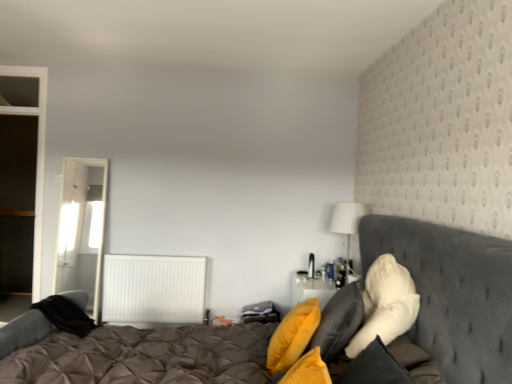
Measure the distance between white textured radiator at center and camera.

The depth of white textured radiator at center is 3.87 meters.

You are a GUI agent. You are given a task and a screenshot of the screen. Output one action in this format:
    pyautogui.click(x=<x>, y=<y>)
    Task: Click on the white textured radiator at center
    
    Given the screenshot: What is the action you would take?
    pyautogui.click(x=153, y=289)

What is the approximate width of tufted fabric bed at center?

tufted fabric bed at center is 7.62 feet wide.

This screenshot has height=384, width=512. I want to click on yellow fabric pillow at center, acting as the first pillow starting from the left, so click(293, 335).

Identify the location of white textured radiator at center. The height and width of the screenshot is (384, 512). (153, 289).

From a real-world perspective, is white textured radiator at center under tufted fabric bed at center?

Yes, from a real-world perspective, white textured radiator at center is under tufted fabric bed at center.

Is white textured radiator at center to the right of tufted fabric bed at center from the viewer's perspective?

A: Incorrect, white textured radiator at center is not on the right side of tufted fabric bed at center.

Can you tell me how much white textured radiator at center and white sheer curtain at left differ in facing direction?

The facing directions of white textured radiator at center and white sheer curtain at left are 89.3 degrees apart.

From the image's perspective, is white textured radiator at center above or below white sheer curtain at left?

From the image's perspective, white textured radiator at center appears below white sheer curtain at left.

Would you say white textured radiator at center is inside or outside white sheer curtain at left?

white textured radiator at center is not enclosed by white sheer curtain at left.

Who is smaller, white textured radiator at center or white sheer curtain at left?

white sheer curtain at left is smaller.

Considering the sizes of soft yellow pillow at right, the second pillow viewed from the left, and white fabric lampshade at upper right in the image, is soft yellow pillow at right, the second pillow viewed from the left, taller or shorter than white fabric lampshade at upper right?

In the image, soft yellow pillow at right, the second pillow viewed from the left, appears to be taller than white fabric lampshade at upper right.

Would you say soft yellow pillow at right, the second pillow viewed from the left, contains white fabric lampshade at upper right?

No, white fabric lampshade at upper right is located outside of soft yellow pillow at right, the second pillow viewed from the left.

How many degrees apart are the facing directions of soft yellow pillow at right, the second pillow viewed from the left, and white fabric lampshade at upper right?

soft yellow pillow at right, the second pillow viewed from the left, and white fabric lampshade at upper right are facing 18.1 degrees away from each other.

Between soft yellow pillow at right, arranged as the 2th pillow when viewed from the right, and white fabric lampshade at upper right, which one has smaller size?

white fabric lampshade at upper right.

Identify the location of the 2nd pillow located beneath the white fabric lampshade at upper right (from a real-world perspective). The image size is (512, 384). (293, 335).

From a real-world perspective, between yellow fabric pillow at center, acting as the first pillow starting from the left, and white fabric lampshade at upper right, who is vertically lower?

yellow fabric pillow at center, acting as the first pillow starting from the left, is physically lower.

How many degrees apart are the facing directions of yellow fabric pillow at center, the third pillow when ordered from right to left, and white fabric lampshade at upper right?

yellow fabric pillow at center, the third pillow when ordered from right to left, and white fabric lampshade at upper right are facing 2.77 degrees away from each other.

Is yellow fabric pillow at center, the third pillow when ordered from right to left, oriented towards white fabric lampshade at upper right?

No, yellow fabric pillow at center, the third pillow when ordered from right to left, is not aimed at white fabric lampshade at upper right.

Consider the image. From the image's perspective, between white fluffy pillow at right, marked as the first pillow in a right-to-left arrangement, and yellow fabric pillow at center, acting as the first pillow starting from the left, which one is located above?

white fluffy pillow at right, marked as the first pillow in a right-to-left arrangement, is shown above in the image.

Are white fluffy pillow at right, the 3th pillow positioned from the left, and yellow fabric pillow at center, the third pillow when ordered from right to left, beside each other?

white fluffy pillow at right, the 3th pillow positioned from the left, is not next to yellow fabric pillow at center, the third pillow when ordered from right to left, and they're not touching.

Does white fluffy pillow at right, marked as the first pillow in a right-to-left arrangement, turn towards yellow fabric pillow at center, the third pillow when ordered from right to left?

No, white fluffy pillow at right, marked as the first pillow in a right-to-left arrangement, is not facing towards yellow fabric pillow at center, the third pillow when ordered from right to left.

Based on the photo, is white fluffy pillow at right, the 3th pillow positioned from the left, taller than yellow fabric pillow at center, acting as the first pillow starting from the left?

Correct, white fluffy pillow at right, the 3th pillow positioned from the left, is much taller as yellow fabric pillow at center, acting as the first pillow starting from the left.

Is white fabric lampshade at upper right next to yellow fabric pillow at center, acting as the first pillow starting from the left, and touching it?

white fabric lampshade at upper right is not next to yellow fabric pillow at center, acting as the first pillow starting from the left, and they're not touching.

From a real-world perspective, is white fabric lampshade at upper right on yellow fabric pillow at center, the third pillow when ordered from right to left?

Yes, from a real-world perspective, white fabric lampshade at upper right is over yellow fabric pillow at center, the third pillow when ordered from right to left

What's the angular difference between white fabric lampshade at upper right and yellow fabric pillow at center, acting as the first pillow starting from the left,'s facing directions?

white fabric lampshade at upper right and yellow fabric pillow at center, acting as the first pillow starting from the left, are facing 2.77 degrees away from each other.

In the scene shown: Is white fabric lampshade at upper right looking in the opposite direction of yellow fabric pillow at center, acting as the first pillow starting from the left?

white fabric lampshade at upper right is not turned away from yellow fabric pillow at center, acting as the first pillow starting from the left.

From the picture: Is tufted fabric bed at center wider or thinner than white sheer curtain at left?

Clearly, tufted fabric bed at center has more width compared to white sheer curtain at left.

In the scene shown: Which is correct: tufted fabric bed at center is inside white sheer curtain at left, or outside of it?

tufted fabric bed at center is not enclosed by white sheer curtain at left.

Locate an element on the screen. bed that appears below the white sheer curtain at left (from the image's perspective) is located at coordinates (452, 293).

Can you tell me how much tufted fabric bed at center and white sheer curtain at left differ in facing direction?

0.673 degrees separate the facing orientations of tufted fabric bed at center and white sheer curtain at left.

In order to click on bed above the white textured radiator at center (from the image's perspective) in this screenshot , I will do `click(452, 293)`.

Where is `curtain on the left of the white textured radiator at center`? The width and height of the screenshot is (512, 384). curtain on the left of the white textured radiator at center is located at coordinates (69, 234).

In the scene shown: Considering their positions, is tufted fabric bed at center positioned further to yellow fabric pillow at center, the third pillow when ordered from right to left, than white textured radiator at center?

white textured radiator at center.

Considering their positions, is soft yellow pillow at right, the second pillow viewed from the left, positioned closer to tufted fabric bed at center than white sheer curtain at left?

The object closer to tufted fabric bed at center is soft yellow pillow at right, the second pillow viewed from the left.

When comparing their distances from white textured radiator at center, does white fabric lampshade at upper right or tufted fabric bed at center seem further?

white fabric lampshade at upper right is positioned further to the anchor white textured radiator at center.

When comparing their distances from soft yellow pillow at right, the second pillow viewed from the left, does white textured radiator at center or tufted fabric bed at center seem further?

white textured radiator at center is positioned further to the anchor soft yellow pillow at right, the second pillow viewed from the left.

Considering their positions, is soft yellow pillow at right, the second pillow viewed from the left, positioned further to white fluffy pillow at right, the 3th pillow positioned from the left, than tufted fabric bed at center?

The object further to white fluffy pillow at right, the 3th pillow positioned from the left, is tufted fabric bed at center.

From the image, which object appears to be farther from tufted fabric bed at center, white textured radiator at center or white fabric lampshade at upper right?

white fabric lampshade at upper right lies further to tufted fabric bed at center than the other object.

From the image, which object appears to be farther from yellow fabric pillow at center, the third pillow when ordered from right to left, white fabric lampshade at upper right or soft yellow pillow at right, the second pillow viewed from the left?

white fabric lampshade at upper right lies further to yellow fabric pillow at center, the third pillow when ordered from right to left, than the other object.

Consider the image. Estimate the real-world distances between objects in this image. Which object is closer to white fabric lampshade at upper right, soft yellow pillow at right, the second pillow viewed from the left, or yellow fabric pillow at center, acting as the first pillow starting from the left?

The object closer to white fabric lampshade at upper right is soft yellow pillow at right, the second pillow viewed from the left.

The image size is (512, 384). I want to click on radiator between yellow fabric pillow at center, the third pillow when ordered from right to left, and white sheer curtain at left in the front-back direction, so click(x=153, y=289).

Identify the location of pillow between tufted fabric bed at center and white fluffy pillow at right, the 3th pillow positioned from the left, from front to back. The height and width of the screenshot is (384, 512). (293, 335).

Locate an element on the screen. Image resolution: width=512 pixels, height=384 pixels. table lamp located between soft yellow pillow at right, arranged as the 2th pillow when viewed from the right, and white textured radiator at center in the depth direction is located at coordinates (346, 223).

This screenshot has width=512, height=384. In order to click on table lamp between tufted fabric bed at center and white textured radiator at center in the front-back direction in this screenshot , I will do `click(346, 223)`.